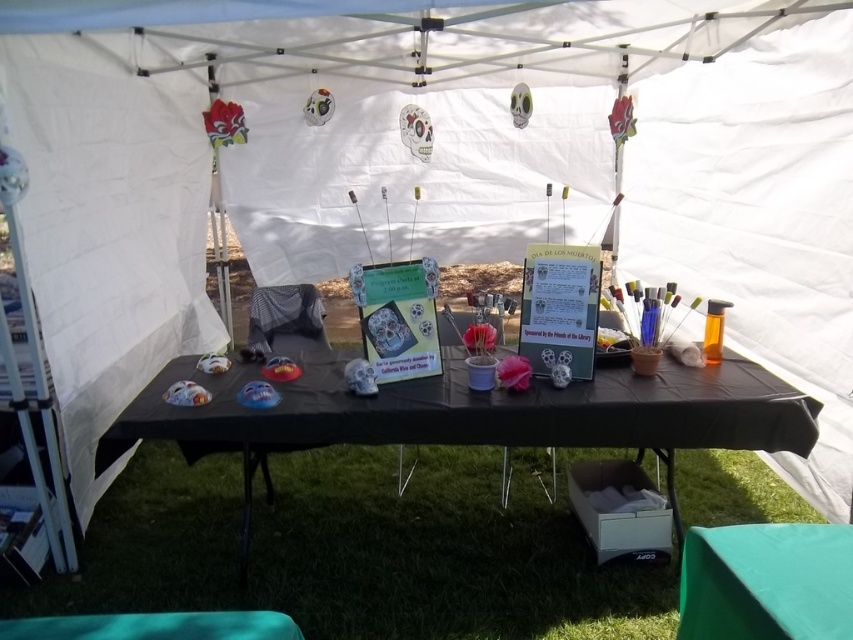
Question: Among these objects, which one is nearest to the camera?

Choices:
 (A) green grass at lower center
 (B) black matte picnic table at center

Answer: (B)

Question: Is green grass at lower center further to the viewer compared to black matte picnic table at center?

Choices:
 (A) no
 (B) yes

Answer: (B)

Question: Is green grass at lower center smaller than black matte picnic table at center?

Choices:
 (A) yes
 (B) no

Answer: (B)

Question: Which of the following is the closest to the observer?

Choices:
 (A) green grass at lower center
 (B) black matte picnic table at center

Answer: (B)

Question: Is the position of green grass at lower center less distant than that of black matte picnic table at center?

Choices:
 (A) yes
 (B) no

Answer: (B)

Question: Among these objects, which one is nearest to the camera?

Choices:
 (A) green grass at lower center
 (B) black matte picnic table at center

Answer: (B)